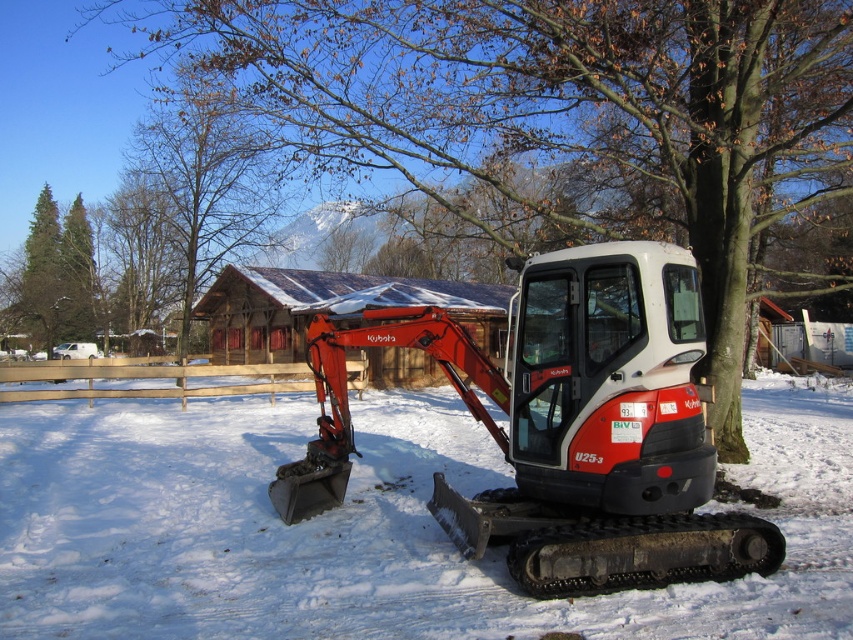
You are a drone operator trying to capture a photo of the Kubota excavator. To avoid the brown textured tree at center, where should you position the drone relative to the excavator?

The brown textured tree at center is located at point (570, 122), so you should position the drone away from that coordinate to avoid obstruction.

You are standing at the center of the snowy ground and want to walk towards the rustic wooden building in the background. Is the brown textured tree at center in your path? Please explain using coordinates.

The brown textured tree at center is located at coordinates point (570, 122), so yes, it is in your path towards the rustic wooden building in the background.

You are standing at the center of the snowy area. You want to move toward the excavator labeled U25 3. Which direction should you move in relation to the white powdery snow at center?

You should move away from the white powdery snow at center towards the excavator labeled U25 3.